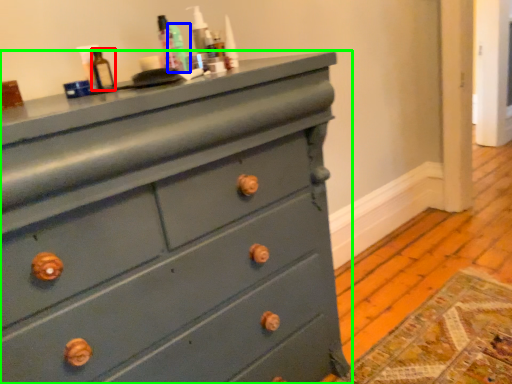
Question: Based on their relative distances, which object is nearer to bottle (highlighted by a red box)? Choose from teal (highlighted by a blue box) and chest of drawers (highlighted by a green box).

Choices:
 (A) teal
 (B) chest of drawers

Answer: (A)